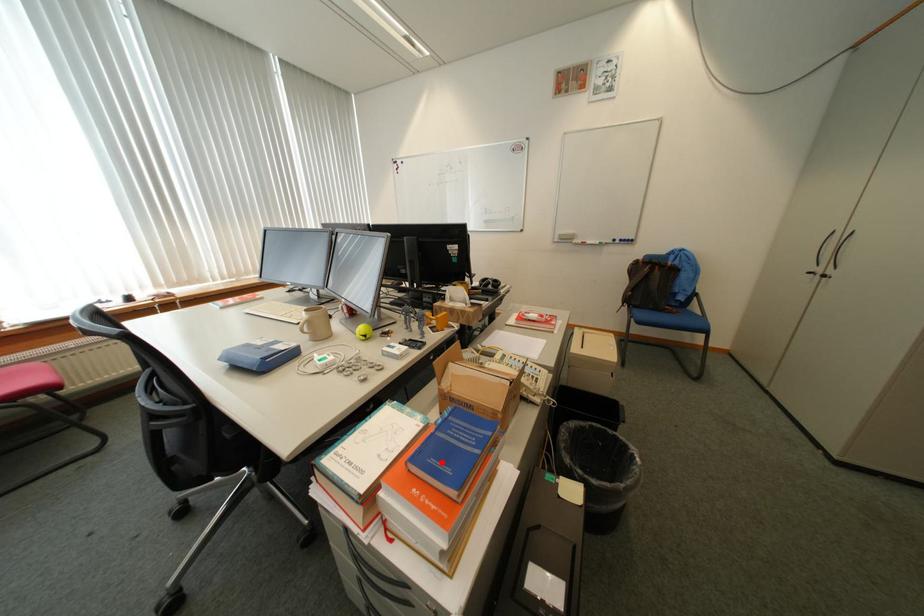
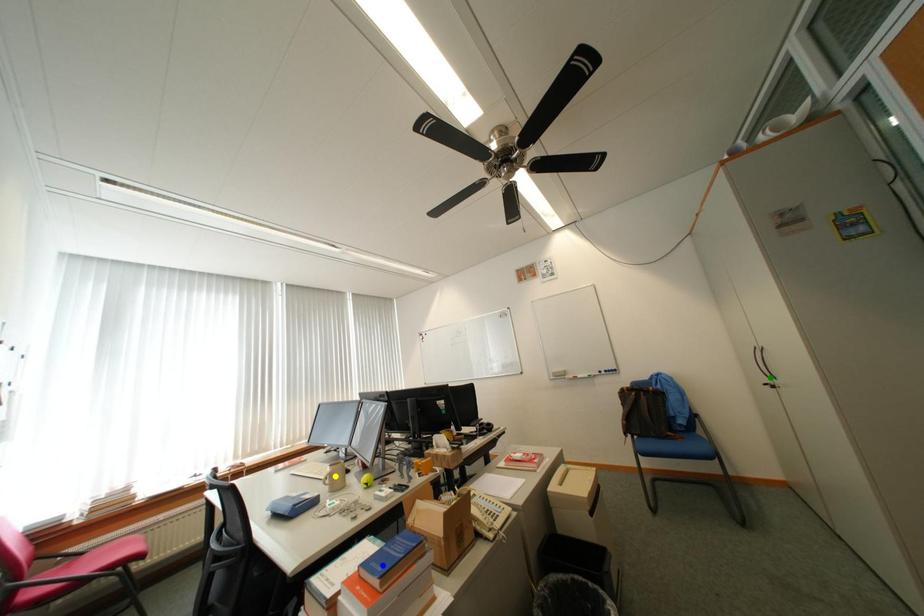
Question: I am providing you with two images of the same scene from different viewpoints. A red point is marked on the first image. You are given multiple points on the second image. In image 2, which mark is for the same physical point as the one in image 1?

Choices:
 (A) yellow point
 (B) green point
 (C) blue point

Answer: (C)